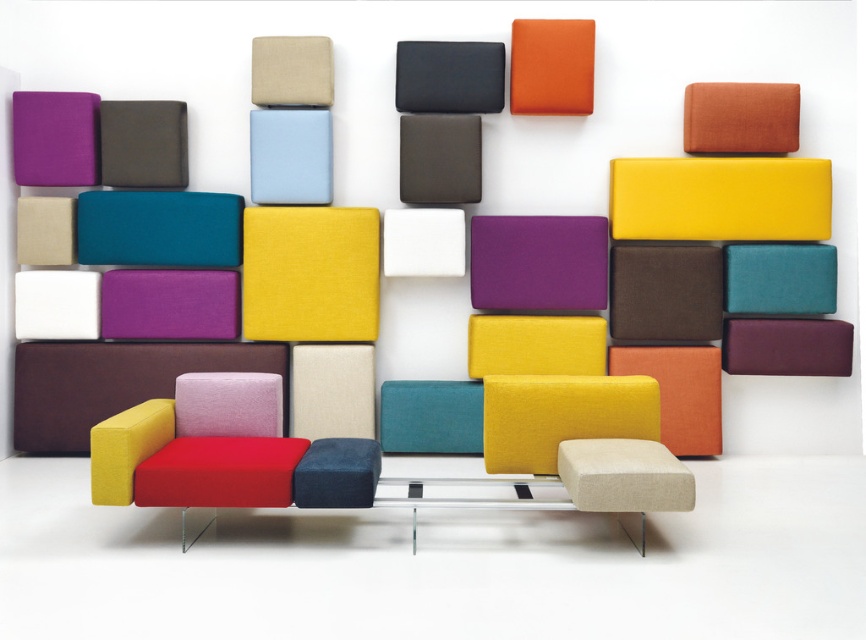
Question: Does teal fabric cushion at upper right lie behind light blue fabric cushion at center?

Choices:
 (A) no
 (B) yes

Answer: (B)

Question: Which point is closer to the camera taking this photo?

Choices:
 (A) (143, 157)
 (B) (485, 49)
 (C) (755, 173)
 (D) (66, 333)

Answer: (B)

Question: Which point is farther to the camera?

Choices:
 (A) white matte rectangle at lower left
 (B) matte fabric armchair at lower left
 (C) white fabric rectangle at center

Answer: (A)

Question: Can you confirm if teal fabric cushion at upper right is positioned to the right of white matte rectangle at lower left?

Choices:
 (A) yes
 (B) no

Answer: (A)

Question: Among these objects, which one is nearest to the camera?

Choices:
 (A) yellow matte rectangular cushion at upper right
 (B) matte beige cushion at upper left
 (C) matte blue stool at center
 (D) matte black cushion at upper center

Answer: (C)

Question: Does matte black cushion at upper center appear on the right side of matte gray cube at center?

Choices:
 (A) yes
 (B) no

Answer: (A)